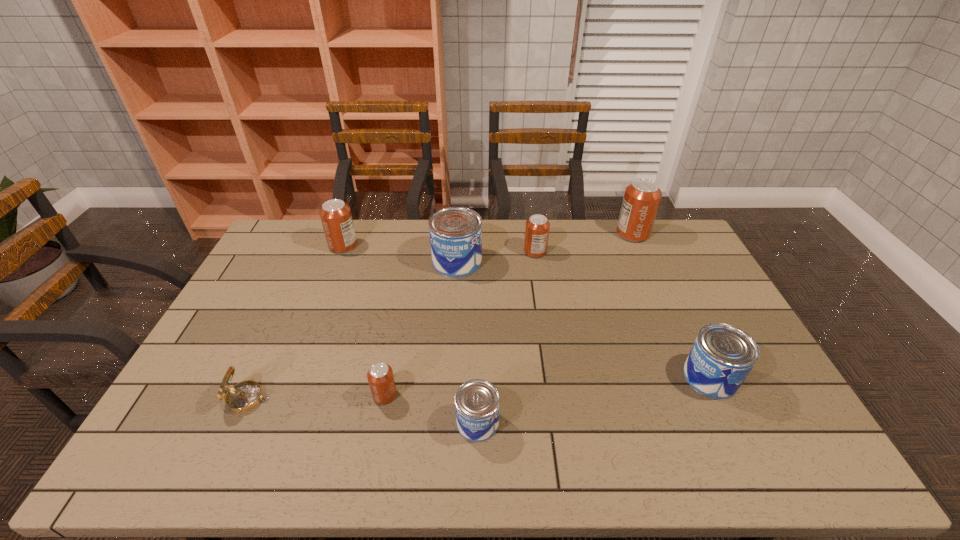
In the image, there is a desktop. Identify the location of vacant space at the far right corner. (696, 252).

Image resolution: width=960 pixels, height=540 pixels. Identify the location of free space between the smallest blue can and the second biggest orange can. (411, 334).

The width and height of the screenshot is (960, 540). Identify the location of unoccupied position between the third orange can from right to left and the compass. (316, 397).

This screenshot has width=960, height=540. Identify the location of vacant region between the sixth object from left to right and the biggest orange can. (584, 242).

Identify the location of vacant point located between the second smallest blue can and the third biggest orange can. (623, 314).

Locate an element on the screen. This screenshot has height=540, width=960. vacant region between the smallest orange can and the second biggest orange can is located at coordinates (364, 320).

Where is `vacant area between the compass and the leftmost orange can`? This screenshot has width=960, height=540. vacant area between the compass and the leftmost orange can is located at coordinates (296, 322).

The image size is (960, 540). I want to click on free space between the farthest blue can and the nearest blue can, so click(468, 342).

The image size is (960, 540). Find the location of `vacant region between the smallest blue can and the second smallest blue can`. vacant region between the smallest blue can and the second smallest blue can is located at coordinates (594, 400).

Locate an element on the screen. The height and width of the screenshot is (540, 960). vacant space that's between the leftmost orange can and the compass is located at coordinates (296, 322).